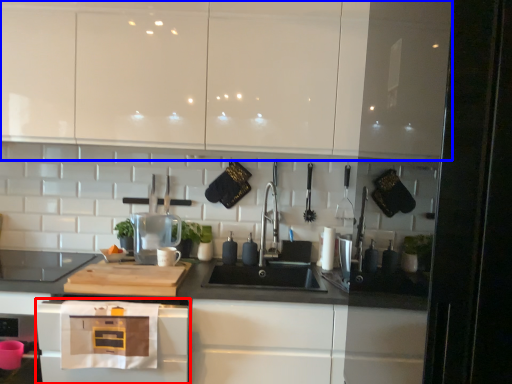
Question: Which of the following is the farthest to the observer, home appliance (highlighted by a red box) or cabinetry (highlighted by a blue box)?

Choices:
 (A) home appliance
 (B) cabinetry

Answer: (B)